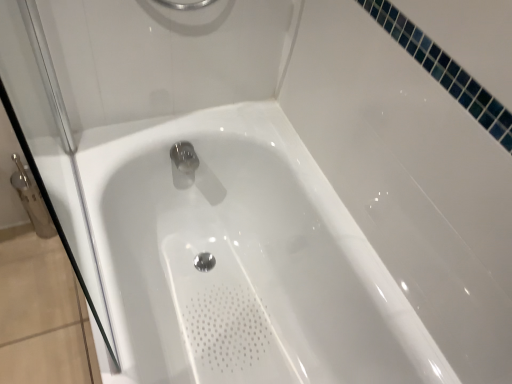
Locate an element on the screen. The height and width of the screenshot is (384, 512). transparent glass shower door at left is located at coordinates (49, 142).

What do you see at coordinates (49, 142) in the screenshot? I see `transparent glass shower door at left` at bounding box center [49, 142].

What do you see at coordinates (241, 259) in the screenshot? This screenshot has width=512, height=384. I see `white glossy bathtub at center` at bounding box center [241, 259].

Measure the distance between point (132, 230) and camera.

The distance of point (132, 230) from camera is 1.35 meters.

Find the location of a particular element. This screenshot has width=512, height=384. white glossy bathtub at center is located at coordinates (241, 259).

Identify the location of transparent glass shower door at left. The width and height of the screenshot is (512, 384). (49, 142).

Based on the photo, based on their positions, is white glossy bathtub at center located to the left or right of transparent glass shower door at left?

white glossy bathtub at center is to the right of transparent glass shower door at left.

Between white glossy bathtub at center and transparent glass shower door at left, which one is positioned behind?

white glossy bathtub at center is further away from the camera.

Which point is more forward, (404, 370) or (49, 148)?

Point (404, 370)

From the image's perspective, is white glossy bathtub at center above transparent glass shower door at left?

Actually, white glossy bathtub at center appears below transparent glass shower door at left in the image.

From a real-world perspective, which object rests below the other?

white glossy bathtub at center is physically lower.

From the picture: In terms of width, does white glossy bathtub at center look wider or thinner when compared to transparent glass shower door at left?

Clearly, white glossy bathtub at center has more width compared to transparent glass shower door at left.

Can you confirm if white glossy bathtub at center is shorter than transparent glass shower door at left?

Yes.

Considering the relative sizes of white glossy bathtub at center and transparent glass shower door at left in the image provided, is white glossy bathtub at center bigger than transparent glass shower door at left?

Indeed, white glossy bathtub at center has a larger size compared to transparent glass shower door at left.

Is transparent glass shower door at left located within white glossy bathtub at center?

Definitely not — transparent glass shower door at left is not inside white glossy bathtub at center.

Is white glossy bathtub at center far away from transparent glass shower door at left?

No, white glossy bathtub at center is in close proximity to transparent glass shower door at left.

From the picture: Does white glossy bathtub at center turn towards transparent glass shower door at left?

No, white glossy bathtub at center is not facing towards transparent glass shower door at left.

Can you tell me how much white glossy bathtub at center and transparent glass shower door at left differ in facing direction?

white glossy bathtub at center and transparent glass shower door at left are facing 0.0027 degrees away from each other.

At what (x,y) coordinates should I click in order to perform the action: click on shower door in front of the white glossy bathtub at center. Please return your answer as a coordinate pair (x, y). The height and width of the screenshot is (384, 512). Looking at the image, I should click on point(49,142).

Is transparent glass shower door at left to the left of white glossy bathtub at center from the viewer's perspective?

Correct, you'll find transparent glass shower door at left to the left of white glossy bathtub at center.

Between transparent glass shower door at left and white glossy bathtub at center, which one is positioned behind?

white glossy bathtub at center is more distant.

Does point (39, 106) appear closer or farther from the camera than point (224, 192)?

Point (39, 106) is positioned closer to the camera compared to point (224, 192).

From the image's perspective, is transparent glass shower door at left positioned above or below white glossy bathtub at center?

transparent glass shower door at left is above white glossy bathtub at center.

From a real-world perspective, is transparent glass shower door at left on top of white glossy bathtub at center?

Yes, from a real-world perspective, transparent glass shower door at left is over white glossy bathtub at center

Considering the relative sizes of transparent glass shower door at left and white glossy bathtub at center in the image provided, is transparent glass shower door at left wider than white glossy bathtub at center?

No.

From their relative heights in the image, would you say transparent glass shower door at left is taller or shorter than white glossy bathtub at center?

transparent glass shower door at left is taller than white glossy bathtub at center.

Is transparent glass shower door at left smaller than white glossy bathtub at center?

Yes, transparent glass shower door at left is smaller than white glossy bathtub at center.

Would you say transparent glass shower door at left is outside white glossy bathtub at center?

That's correct, transparent glass shower door at left is outside of white glossy bathtub at center.

Can you see transparent glass shower door at left touching white glossy bathtub at center?

No, transparent glass shower door at left is not next to white glossy bathtub at center.

Is white glossy bathtub at center at the back of transparent glass shower door at left?

transparent glass shower door at left does not have its back to white glossy bathtub at center.

How different are the orientations of transparent glass shower door at left and white glossy bathtub at center in degrees?

The facing directions of transparent glass shower door at left and white glossy bathtub at center are 0.0027 degrees apart.

Measure the distance between transparent glass shower door at left and white glossy bathtub at center.

A distance of 14.47 inches exists between transparent glass shower door at left and white glossy bathtub at center.

What are the coordinates of `bathtub behind the transparent glass shower door at left` in the screenshot? It's located at (241, 259).

Identify the location of shower door located above the white glossy bathtub at center (from the image's perspective). This screenshot has height=384, width=512. (49, 142).

What are the coordinates of `bathtub that is under the transparent glass shower door at left (from a real-world perspective)` in the screenshot? It's located at (241, 259).